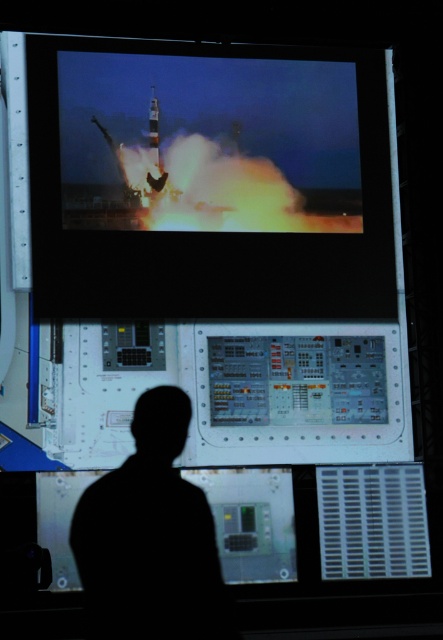
Question: Among these objects, which one is farthest from the camera?

Choices:
 (A) black matte silhouette at center
 (B) shiny metallic missile at upper center

Answer: (B)

Question: Which of the following is the farthest from the observer?

Choices:
 (A) black matte silhouette at center
 (B) matte black rocket at upper center

Answer: (B)

Question: Where is black matte silhouette at center located in relation to shiny metallic missile at upper center in the image?

Choices:
 (A) above
 (B) below

Answer: (B)

Question: From the image, what is the correct spatial relationship of matte black rocket at upper center in relation to black matte silhouette at center?

Choices:
 (A) left
 (B) right

Answer: (B)

Question: Is matte black rocket at upper center thinner than black matte silhouette at center?

Choices:
 (A) yes
 (B) no

Answer: (B)

Question: Which of these objects is positioned farthest from the matte black rocket at upper center?

Choices:
 (A) shiny metallic missile at upper center
 (B) black matte silhouette at center

Answer: (B)